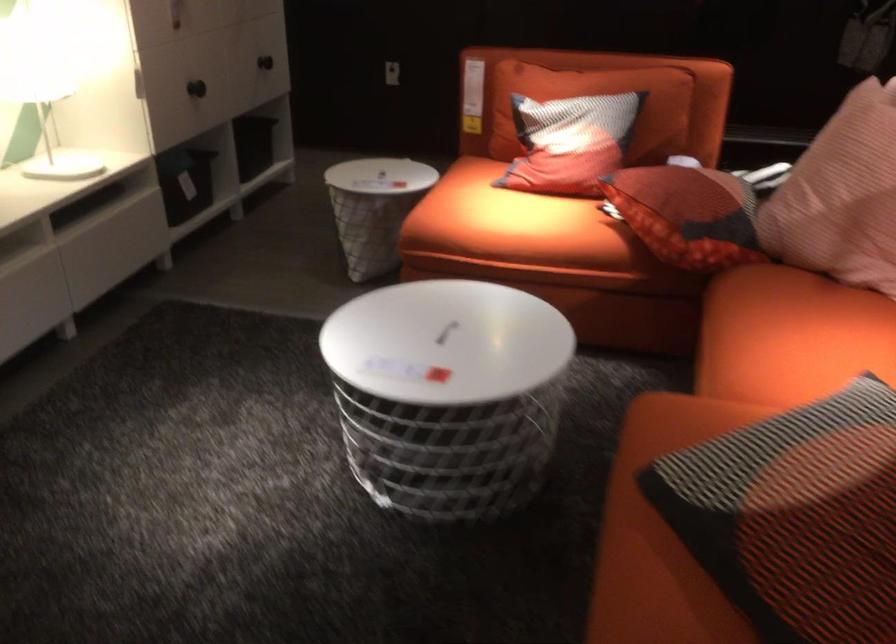
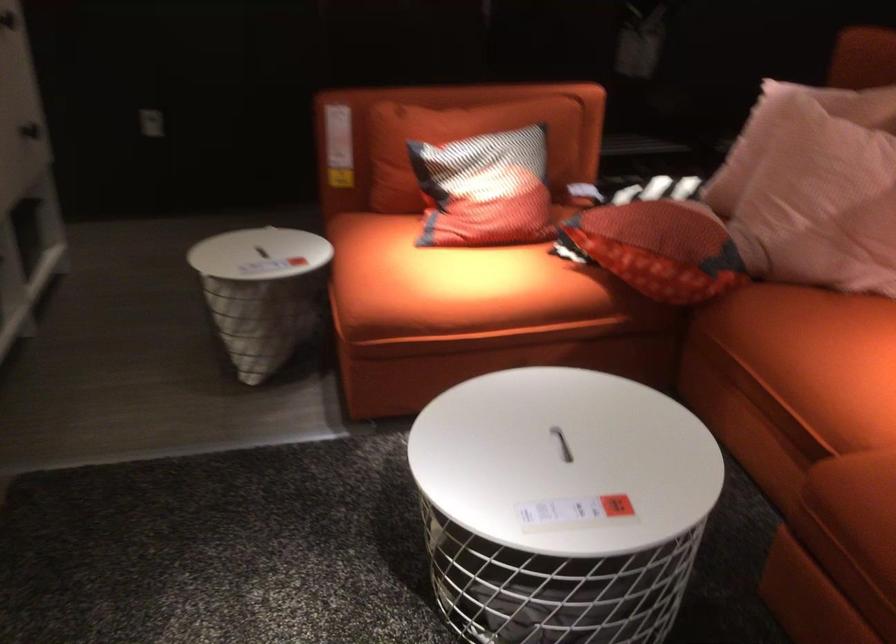
The point at (467, 341) is marked in the first image. Where is the corresponding point in the second image?

(562, 444)